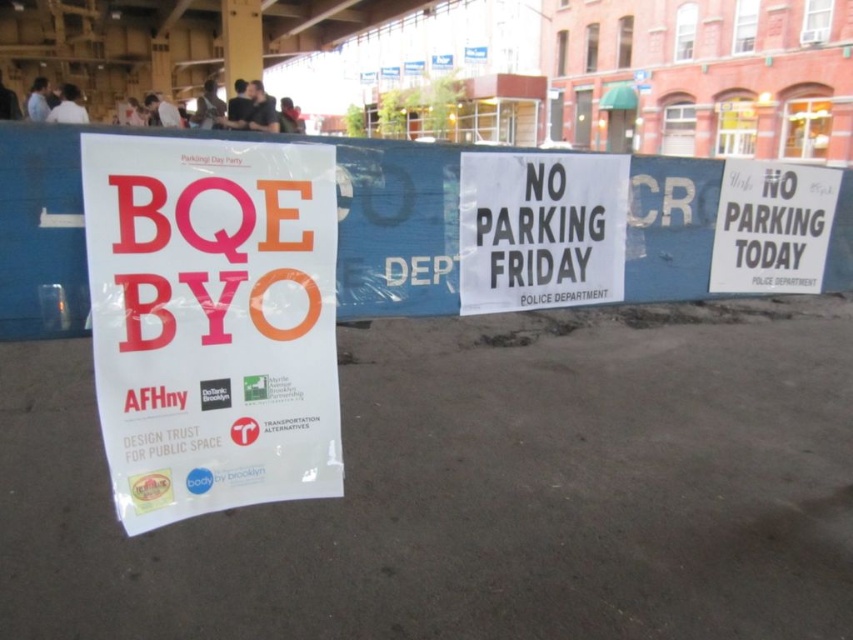
Between point (119, 372) and point (679, 177), which one is positioned in front?

Positioned in front is point (119, 372).

Is white paper poster at center to the left of white paper sign at center from the viewer's perspective?

Yes, white paper poster at center is to the left of white paper sign at center.

Is point (181, 241) positioned after point (648, 275)?

No, it is not.

The height and width of the screenshot is (640, 853). Identify the location of white paper poster at center. pyautogui.click(x=212, y=323).